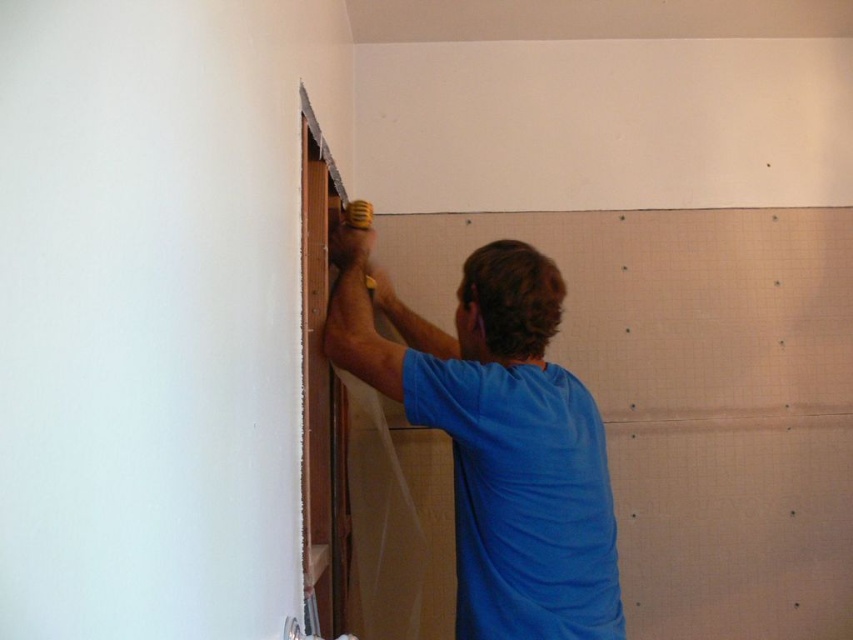
Can you confirm if blue fabric shirt at center is taller than yellow rubber drill at upper center?

Yes, blue fabric shirt at center is taller than yellow rubber drill at upper center.

Is blue fabric shirt at center thinner than yellow rubber drill at upper center?

Incorrect, blue fabric shirt at center's width is not less than yellow rubber drill at upper center's.

Where is `blue fabric shirt at center`? This screenshot has height=640, width=853. blue fabric shirt at center is located at coordinates (497, 436).